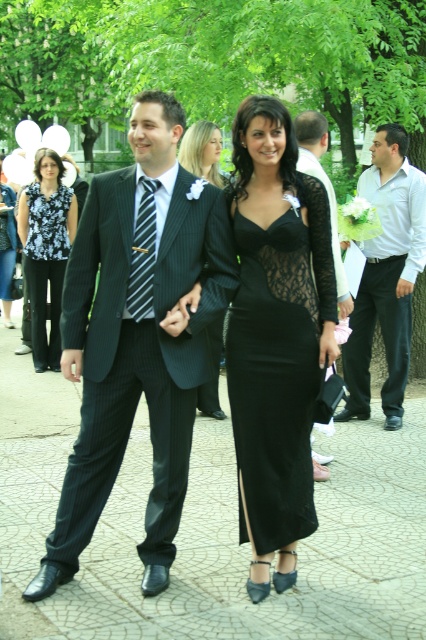
You are standing at the position of the couple in the image and want to move towards the point labeled as point [402,342]. However, there is an obstacle at point [291,371]. Will you encounter this obstacle before reaching your destination?

Yes, you will encounter the obstacle at point [291,371] before reaching point [402,342] because point [291,371] is in front of point [402,342].

Looking at this image, you are a photographer standing at the event. You want to take a closeup shot of the white shirt at center. Given that your camera can focus up to 6 meters, will you be able to capture a clear image?

The white shirt at center is 6.68 meters away from the camera. Since the camera can only focus up to 6 meters, it won not be able to capture a clear image of the white shirt at center.

You are a photographer at a wedding event and you see the floral print blouse at center and the matte black dress at center. Which one is positioned to the right side of the other?

The floral print blouse at center is to the right of matte black dress at center.